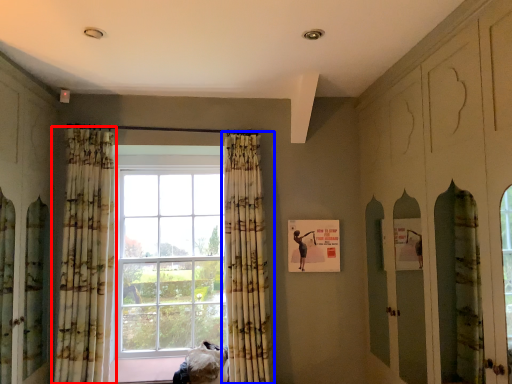
Question: Among these objects, which one is nearest to the camera, curtain (highlighted by a red box) or curtain (highlighted by a blue box)?

Choices:
 (A) curtain
 (B) curtain

Answer: (A)